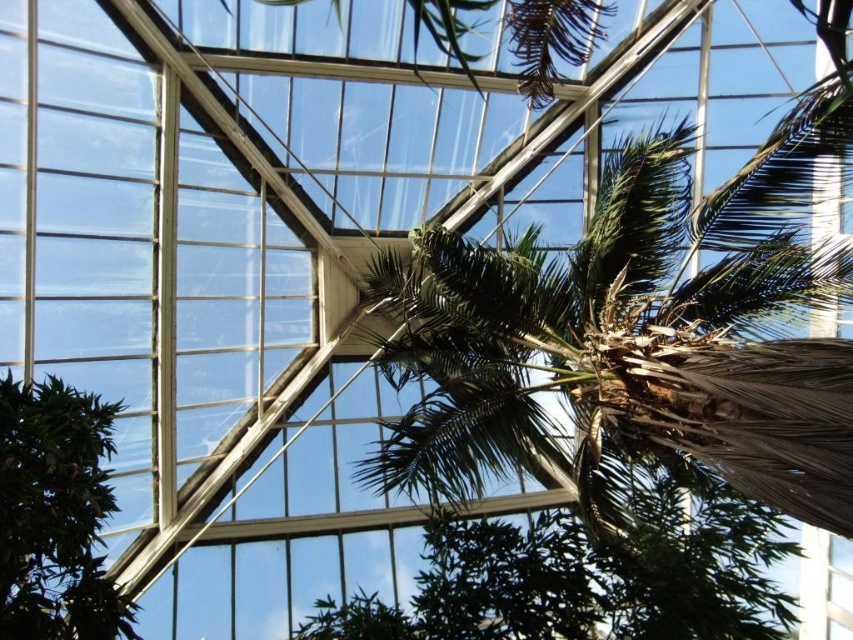
Which is behind, point (397, 472) or point (15, 477)?

Point (397, 472)

The image size is (853, 640). Describe the element at coordinates (634, 340) in the screenshot. I see `green leafy palm tree at center` at that location.

This screenshot has width=853, height=640. What do you see at coordinates (634, 340) in the screenshot?
I see `green leafy palm tree at center` at bounding box center [634, 340].

Image resolution: width=853 pixels, height=640 pixels. What are the coordinates of `green leafy palm tree at center` in the screenshot? It's located at (634, 340).